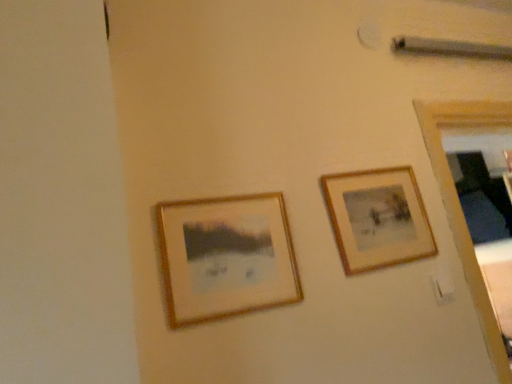
What do you see at coordinates (226, 257) in the screenshot? I see `wooden framed picture at center left, the first picture frame in the front-to-back sequence` at bounding box center [226, 257].

How much space does wooden framed picture at center left, the first picture frame in the front-to-back sequence, occupy vertically?

The height of wooden framed picture at center left, the first picture frame in the front-to-back sequence, is 10.93 inches.

Find the location of a particular element. The image size is (512, 384). wooden framed picture at center left, which ranks as the 2th picture frame in right-to-left order is located at coordinates (226, 257).

At what (x,y) coordinates should I click in order to perform the action: click on wooden frame at upper right, which is counted as the first picture frame, starting from the right. Please return your answer as a coordinate pair (x, y). Looking at the image, I should click on (377, 218).

Describe the element at coordinates (377, 218) in the screenshot. I see `wooden frame at upper right, placed as the second picture frame when sorted from left to right` at that location.

At what (x,y) coordinates should I click in order to perform the action: click on wooden framed picture at center left, which is the second picture frame from back to front. Please return your answer as a coordinate pair (x, y). The height and width of the screenshot is (384, 512). Looking at the image, I should click on (226, 257).

In the image, is wooden framed picture at center left, arranged as the first picture frame when viewed from the left, on the left side or the right side of wooden frame at upper right, which is counted as the first picture frame, starting from the right?

Clearly, wooden framed picture at center left, arranged as the first picture frame when viewed from the left, is on the left of wooden frame at upper right, which is counted as the first picture frame, starting from the right, in the image.

Which object is further away from the camera, wooden framed picture at center left, which ranks as the 2th picture frame in right-to-left order, or wooden frame at upper right, marked as the 1th picture frame in a back-to-front arrangement?

wooden frame at upper right, marked as the 1th picture frame in a back-to-front arrangement.

Which is in front, point (297, 279) or point (399, 212)?

Positioned in front is point (297, 279).

From the image's perspective, which object appears higher, wooden framed picture at center left, which ranks as the 2th picture frame in right-to-left order, or wooden frame at upper right, which is counted as the first picture frame, starting from the right?

wooden frame at upper right, which is counted as the first picture frame, starting from the right, appears higher in the image.

From a real-world perspective, between wooden framed picture at center left, which ranks as the 2th picture frame in right-to-left order, and wooden frame at upper right, which is counted as the first picture frame, starting from the right, who is vertically higher?

wooden frame at upper right, which is counted as the first picture frame, starting from the right, from a real-world perspective.

Is wooden framed picture at center left, the first picture frame in the front-to-back sequence, thinner than wooden frame at upper right, marked as the 1th picture frame in a back-to-front arrangement?

No, wooden framed picture at center left, the first picture frame in the front-to-back sequence, is not thinner than wooden frame at upper right, marked as the 1th picture frame in a back-to-front arrangement.

From the picture: Does wooden framed picture at center left, arranged as the first picture frame when viewed from the left, have a lesser height compared to wooden frame at upper right, placed as the second picture frame when sorted from left to right?

Correct, wooden framed picture at center left, arranged as the first picture frame when viewed from the left, is not as tall as wooden frame at upper right, placed as the second picture frame when sorted from left to right.

Who is smaller, wooden framed picture at center left, arranged as the first picture frame when viewed from the left, or wooden frame at upper right, placed as the second picture frame when sorted from left to right?

With smaller size is wooden framed picture at center left, arranged as the first picture frame when viewed from the left.

Is wooden framed picture at center left, which is the second picture frame from back to front, not inside wooden frame at upper right, which is counted as the first picture frame, starting from the right?

Yes.

Is wooden framed picture at center left, the first picture frame in the front-to-back sequence, not near wooden frame at upper right, marked as the 1th picture frame in a back-to-front arrangement?

Actually, wooden framed picture at center left, the first picture frame in the front-to-back sequence, and wooden frame at upper right, marked as the 1th picture frame in a back-to-front arrangement, are a little close together.

Is wooden framed picture at center left, which is the second picture frame from back to front, oriented towards wooden frame at upper right, which appears as the second picture frame when viewed from the front?

No, wooden framed picture at center left, which is the second picture frame from back to front, is not oriented towards wooden frame at upper right, which appears as the second picture frame when viewed from the front.

How many degrees apart are the facing directions of wooden framed picture at center left, the first picture frame in the front-to-back sequence, and wooden frame at upper right, marked as the 1th picture frame in a back-to-front arrangement?

The facing directions of wooden framed picture at center left, the first picture frame in the front-to-back sequence, and wooden frame at upper right, marked as the 1th picture frame in a back-to-front arrangement, are 0.00368 degrees apart.

This screenshot has width=512, height=384. In order to click on picture frame that is on the left side of wooden frame at upper right, placed as the second picture frame when sorted from left to right in this screenshot , I will do `click(226, 257)`.

In the image, is wooden frame at upper right, marked as the 1th picture frame in a back-to-front arrangement, on the left side or the right side of wooden framed picture at center left, which is the second picture frame from back to front?

wooden frame at upper right, marked as the 1th picture frame in a back-to-front arrangement, is to the right of wooden framed picture at center left, which is the second picture frame from back to front.

Who is more distant, wooden frame at upper right, placed as the second picture frame when sorted from left to right, or wooden framed picture at center left, arranged as the first picture frame when viewed from the left?

wooden frame at upper right, placed as the second picture frame when sorted from left to right, is behind.

Considering the positions of point (366, 179) and point (265, 301), is point (366, 179) closer or farther from the camera than point (265, 301)?

Clearly, point (366, 179) is more distant from the camera than point (265, 301).

From the image's perspective, is wooden frame at upper right, which appears as the second picture frame when viewed from the front, positioned above or below wooden framed picture at center left, the first picture frame in the front-to-back sequence?

wooden frame at upper right, which appears as the second picture frame when viewed from the front, is above wooden framed picture at center left, the first picture frame in the front-to-back sequence.

From a real-world perspective, which is physically above, wooden frame at upper right, marked as the 1th picture frame in a back-to-front arrangement, or wooden framed picture at center left, arranged as the first picture frame when viewed from the left?

In real-world perspective, wooden frame at upper right, marked as the 1th picture frame in a back-to-front arrangement, is above.

Is wooden frame at upper right, which appears as the second picture frame when viewed from the front, wider or thinner than wooden framed picture at center left, arranged as the first picture frame when viewed from the left?

wooden frame at upper right, which appears as the second picture frame when viewed from the front, is thinner than wooden framed picture at center left, arranged as the first picture frame when viewed from the left.

From the picture: Considering the relative sizes of wooden frame at upper right, which appears as the second picture frame when viewed from the front, and wooden framed picture at center left, which is the second picture frame from back to front, in the image provided, is wooden frame at upper right, which appears as the second picture frame when viewed from the front, shorter than wooden framed picture at center left, which is the second picture frame from back to front,?

No.

Between wooden frame at upper right, placed as the second picture frame when sorted from left to right, and wooden framed picture at center left, the first picture frame in the front-to-back sequence, which one has larger size?

wooden frame at upper right, placed as the second picture frame when sorted from left to right.

Is wooden frame at upper right, which appears as the second picture frame when viewed from the front, situated inside wooden framed picture at center left, the first picture frame in the front-to-back sequence, or outside?

wooden frame at upper right, which appears as the second picture frame when viewed from the front, is not enclosed by wooden framed picture at center left, the first picture frame in the front-to-back sequence.

In the scene shown: Is wooden frame at upper right, marked as the 1th picture frame in a back-to-front arrangement, not near wooden framed picture at center left, the first picture frame in the front-to-back sequence?

They are positioned close to each other.

Is wooden frame at upper right, placed as the second picture frame when sorted from left to right, aimed at wooden framed picture at center left, which is the second picture frame from back to front?

No, wooden frame at upper right, placed as the second picture frame when sorted from left to right, is not aimed at wooden framed picture at center left, which is the second picture frame from back to front.

How far apart are wooden frame at upper right, marked as the 1th picture frame in a back-to-front arrangement, and wooden framed picture at center left, which ranks as the 2th picture frame in right-to-left order?

They are 12.06 inches apart.

The width and height of the screenshot is (512, 384). What are the coordinates of `picture frame below the wooden frame at upper right, placed as the second picture frame when sorted from left to right (from the image's perspective)` in the screenshot? It's located at (226, 257).

Where is `picture frame above the wooden framed picture at center left, the first picture frame in the front-to-back sequence (from the image's perspective)`? The image size is (512, 384). picture frame above the wooden framed picture at center left, the first picture frame in the front-to-back sequence (from the image's perspective) is located at coordinates (377, 218).

What are the coordinates of `picture frame that appears behind the wooden framed picture at center left, arranged as the first picture frame when viewed from the left` in the screenshot? It's located at (377, 218).